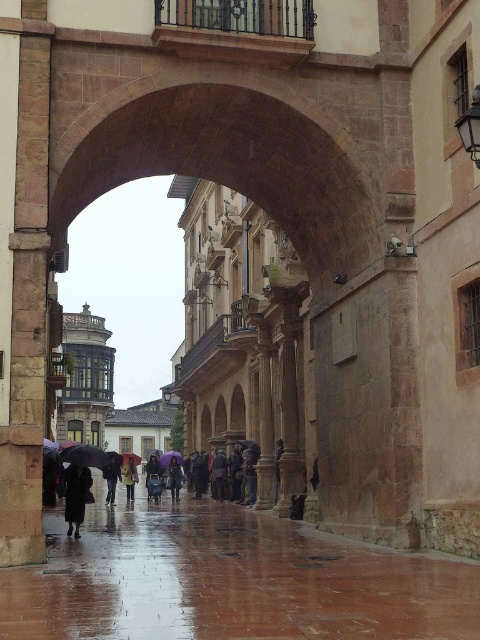
Between dark brown leather coat at center and blue fabric umbrella at center, which one appears on the right side from the viewer's perspective?

Positioned to the right is dark brown leather coat at center.

In the scene shown: Does dark brown leather coat at center appear on the right side of blue fabric umbrella at center?

Yes, dark brown leather coat at center is to the right of blue fabric umbrella at center.

Which is behind, point (110, 500) or point (147, 484)?

The point (147, 484) is behind.

This screenshot has width=480, height=640. I want to click on dark brown leather coat at center, so click(111, 474).

Based on the photo, does black matte umbrella at center come in front of yellow fabric umbrella at center?

Yes, it is.

Based on the photo, does black matte umbrella at center have a greater width compared to yellow fabric umbrella at center?

Yes.

Locate an element on the screen. The width and height of the screenshot is (480, 640). black matte umbrella at center is located at coordinates (85, 456).

Between black matte umbrella at center and dark brown leather coat at center, which one has more height?

Standing taller between the two is black matte umbrella at center.

Does black matte umbrella at center appear over dark brown leather coat at center?

Incorrect, black matte umbrella at center is not positioned above dark brown leather coat at center.

Measure the distance between black matte umbrella at center and camera.

black matte umbrella at center and camera are 191.51 feet apart.

I want to click on black matte umbrella at center, so click(85, 456).